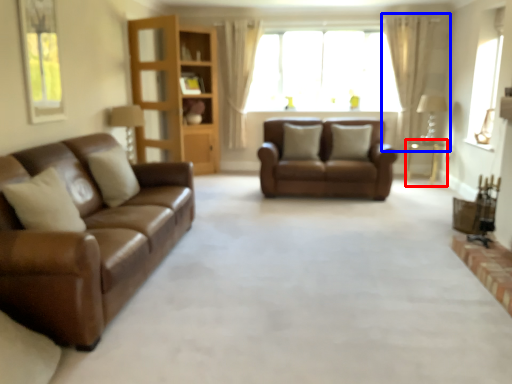
Question: Which object appears closest to the camera in this image, table (highlighted by a red box) or curtain (highlighted by a blue box)?

Choices:
 (A) table
 (B) curtain

Answer: (A)